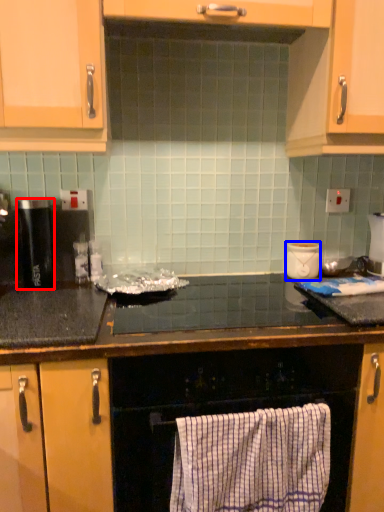
Question: Among these objects, which one is nearest to the camera, kitchen appliance (highlighted by a red box) or appliance (highlighted by a blue box)?

Choices:
 (A) kitchen appliance
 (B) appliance

Answer: (A)